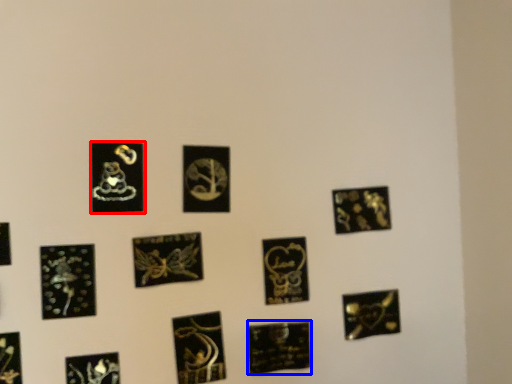
Question: Which of the following is the farthest to the observer, picture frame (highlighted by a red box) or picture frame (highlighted by a blue box)?

Choices:
 (A) picture frame
 (B) picture frame

Answer: (B)